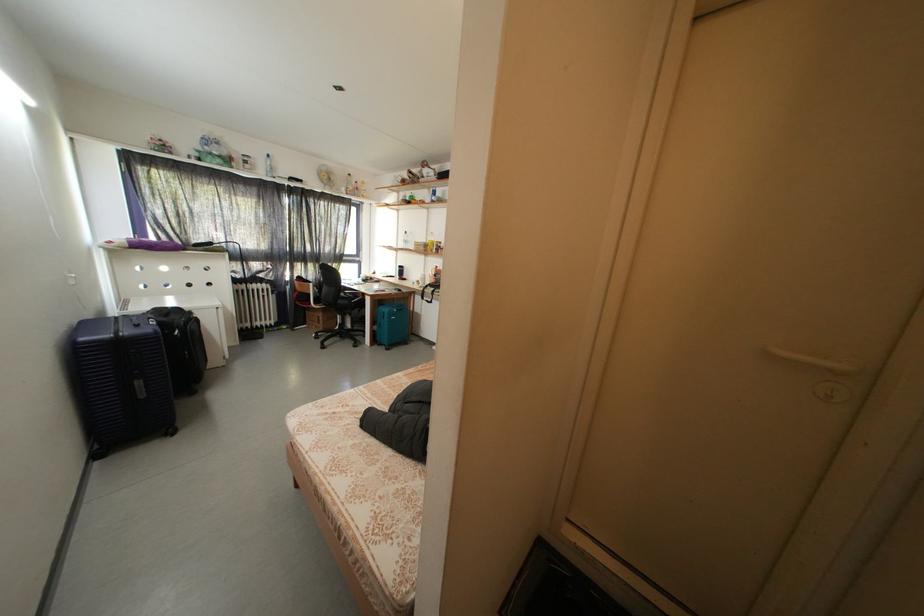
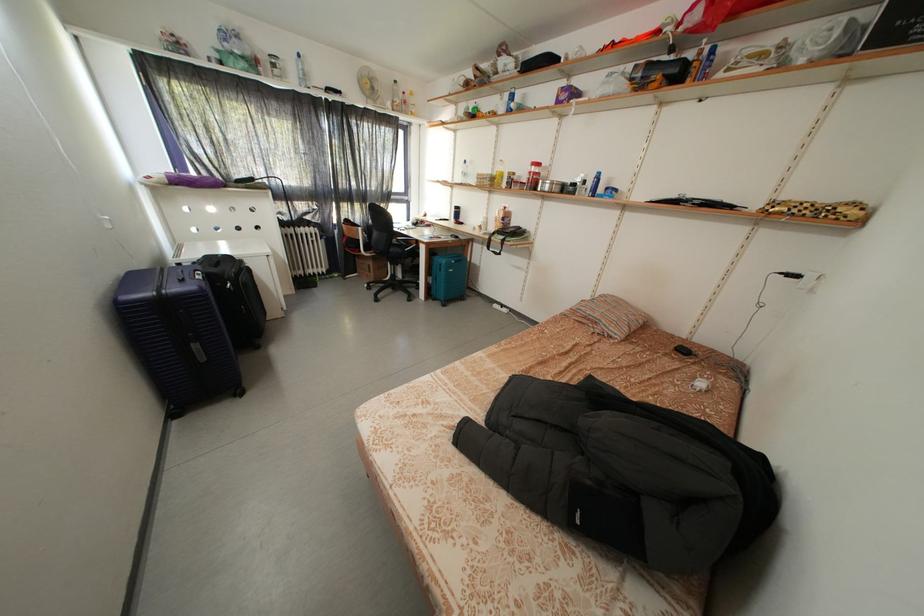
Where in the second image is the point corresponding to [387,350] from the first image?

(442, 305)